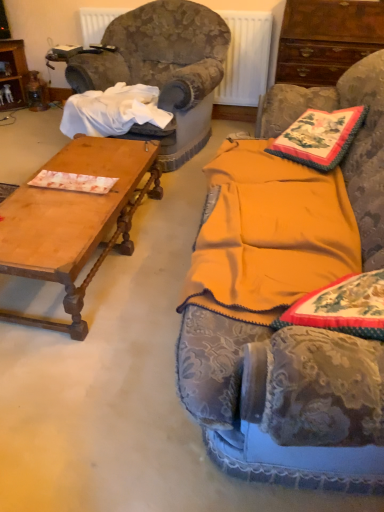
Question: Is velvet-like fabric armchair at left inside the boundaries of wooden polished coffee table at left, or outside?

Choices:
 (A) outside
 (B) inside

Answer: (A)

Question: Looking at their shapes, would you say velvet-like fabric armchair at left is wider or thinner than wooden polished coffee table at left?

Choices:
 (A) wide
 (B) thin

Answer: (A)

Question: Which is nearer to the wooden polished coffee table at left?

Choices:
 (A) velvet-like fabric armchair at left
 (B) velvet fabric couch at center
 (C) embroidered fabric pillow at upper right
 (D) metallic radiator at upper center
 (E) mahogany wood cabinet at upper right

Answer: (A)

Question: Which of these objects is positioned farthest from the wooden polished coffee table at left?

Choices:
 (A) metallic radiator at upper center
 (B) embroidered fabric pillow at upper right
 (C) mahogany wood cabinet at upper right
 (D) velvet-like fabric armchair at left
 (E) velvet fabric couch at center

Answer: (A)